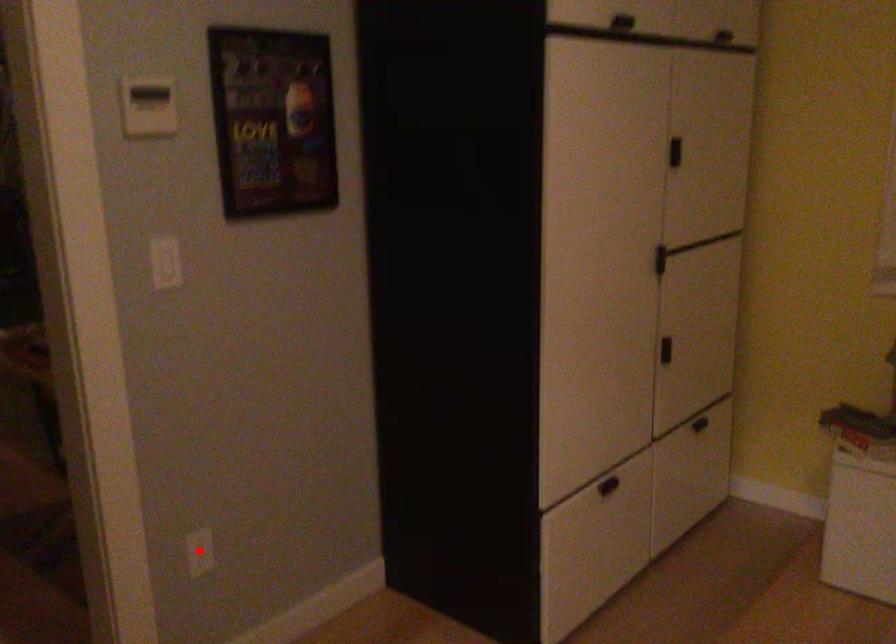
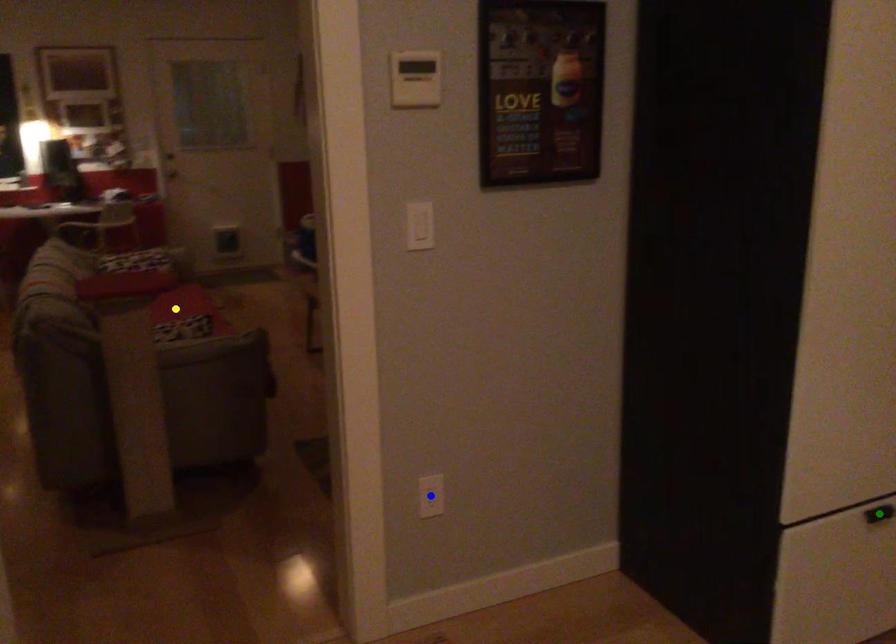
Question: I am providing you with two images of the same scene from different viewpoints. A red point is marked on the first image. You are given multiple points on the second image. Which spot in image 2 lines up with the point in image 1?

Choices:
 (A) blue point
 (B) yellow point
 (C) green point

Answer: (A)